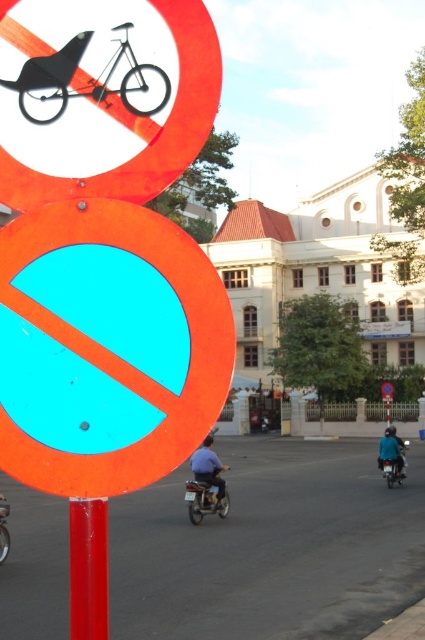
Can you confirm if matte black bicycle at upper left is wider than metallic silver motorcycle at center?

Indeed, matte black bicycle at upper left has a greater width compared to metallic silver motorcycle at center.

Locate an element on the screen. matte black bicycle at upper left is located at coordinates (107, 99).

Based on the photo, is matte black bicycle at upper left further to the viewer compared to metallic blue motorcycle at center?

That is False.

Which is below, matte black bicycle at upper left or metallic blue motorcycle at center?

metallic blue motorcycle at center

In order to click on matte black bicycle at upper left in this screenshot , I will do `click(107, 99)`.

Between orange matte circle at center and matte black bicycle at upper left, which one appears on the right side from the viewer's perspective?

Positioned to the right is orange matte circle at center.

Between orange matte circle at center and matte black bicycle at upper left, which one is positioned lower?

Positioned lower is orange matte circle at center.

Is point (96, 316) closer to camera compared to point (153, 8)?

Yes, it is.

This screenshot has height=640, width=425. What are the coordinates of `orange matte circle at center` in the screenshot? It's located at (107, 348).